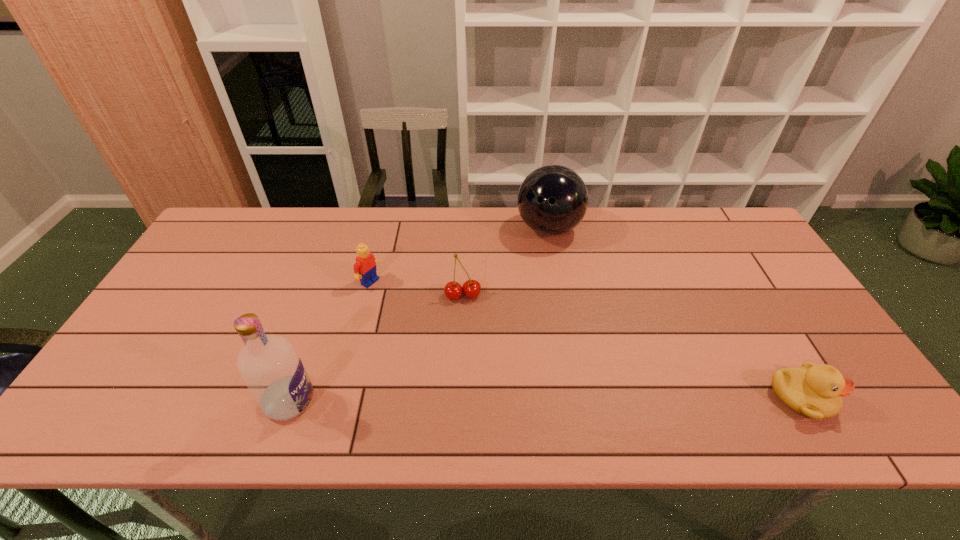
Image resolution: width=960 pixels, height=540 pixels. Find the location of `the tallest object`. the tallest object is located at coordinates (271, 368).

Where is `vodka`? The width and height of the screenshot is (960, 540). vodka is located at coordinates 271,368.

Locate an element on the screen. duckling is located at coordinates (815, 391).

Where is `the shortest object`? the shortest object is located at coordinates (815, 391).

Image resolution: width=960 pixels, height=540 pixels. In order to click on the third object from right to left in this screenshot , I will do `click(453, 290)`.

This screenshot has width=960, height=540. I want to click on bowling ball, so click(x=552, y=200).

What are the coordinates of `the second tallest object` in the screenshot? It's located at (552, 200).

The width and height of the screenshot is (960, 540). What are the coordinates of `the second object from left to right` in the screenshot? It's located at (365, 267).

I want to click on free location located on the front-facing side of the duckling, so click(862, 398).

Where is `free space located 0.080m with the stems of the cherry pointing upwards`? This screenshot has height=540, width=960. free space located 0.080m with the stems of the cherry pointing upwards is located at coordinates (469, 325).